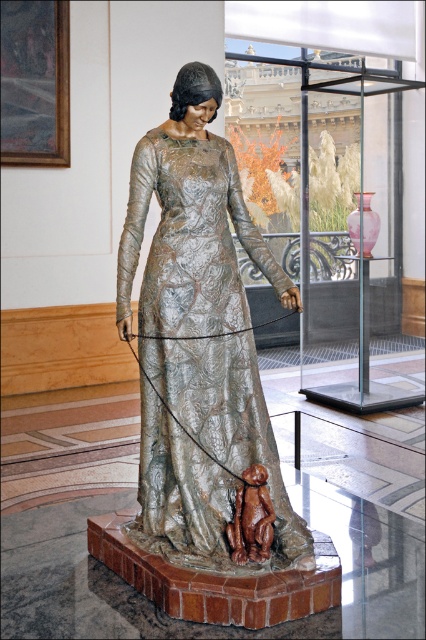
Who is positioned more to the left, shiny silver dress at center or brown clay monkey at lower center?

shiny silver dress at center

Can you confirm if shiny silver dress at center is thinner than brown clay monkey at lower center?

No.

Is point (212, 392) positioned before point (253, 490)?

No, it is not.

This screenshot has width=426, height=640. Find the location of `shiny silver dress at center`. shiny silver dress at center is located at coordinates (204, 307).